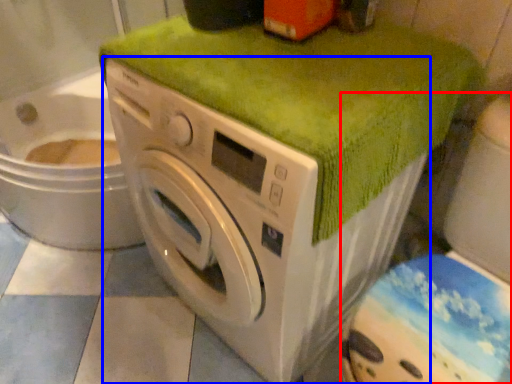
Question: Which object is closer to the camera taking this photo, washer (highlighted by a red box) or washing machine (highlighted by a blue box)?

Choices:
 (A) washer
 (B) washing machine

Answer: (A)